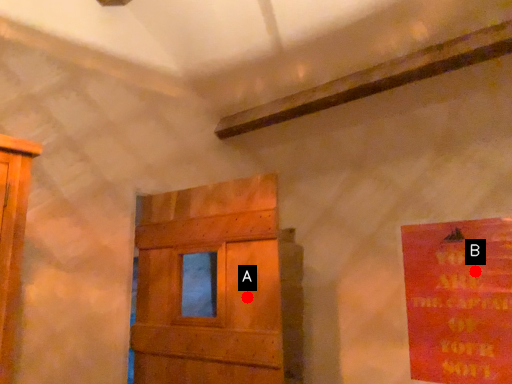
Question: Two points are circled on the image, labeled by A and B beside each circle. Which point appears closest to the camera in this image?

Choices:
 (A) A is closer
 (B) B is closer

Answer: (A)